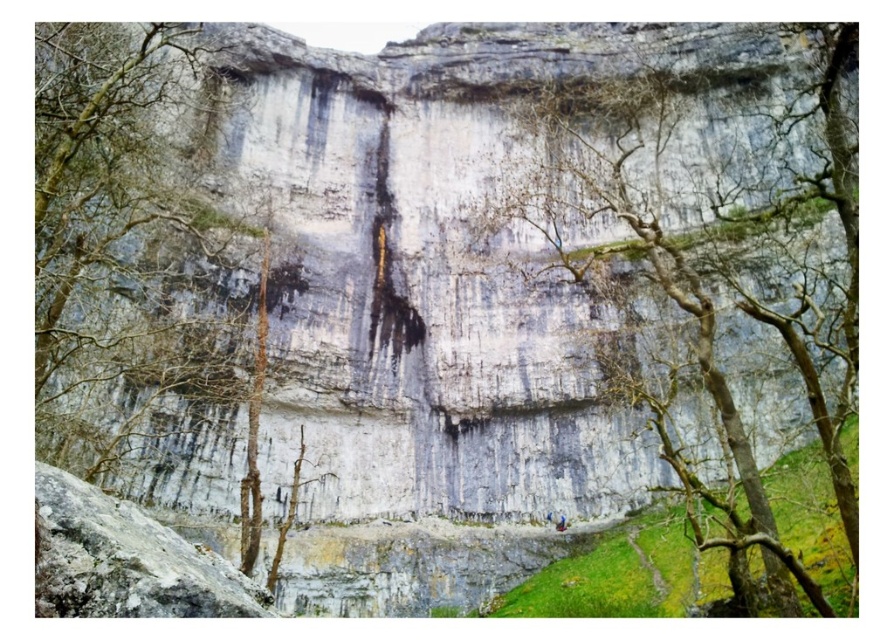
You are standing in the natural landscape scene. You see the gray rough rock at lower left and the blue fabric person at lower center. Which object is positioned to the left of the other?

The gray rough rock at lower left is to the left of blue fabric person at lower center.

You are an artist planning to sketch this scene. You want to ensure the bare branches at center and the gray rough rock at lower left are proportionally accurate. Which object should you draw wider in your sketch?

The bare branches at center might be wider than the gray rough rock at lower left, so you should draw the bare branches at center wider in your sketch.

You are standing at the base of the cliff and see the green leafy tree at center and the blue fabric person at lower center. Which object is bigger in size?

The green leafy tree at center is larger in size than the blue fabric person at lower center.